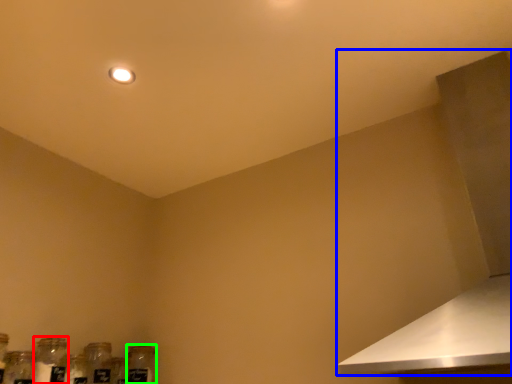
Question: Based on their relative distances, which object is nearer to bottle (highlighted by a red box)? Choose from vent (highlighted by a blue box) and glass bottle (highlighted by a green box).

Choices:
 (A) vent
 (B) glass bottle

Answer: (B)